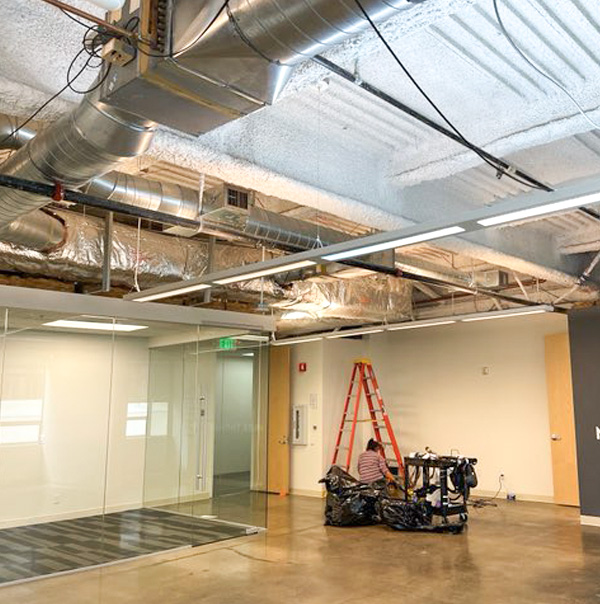
I want to click on floor, so click(325, 557).